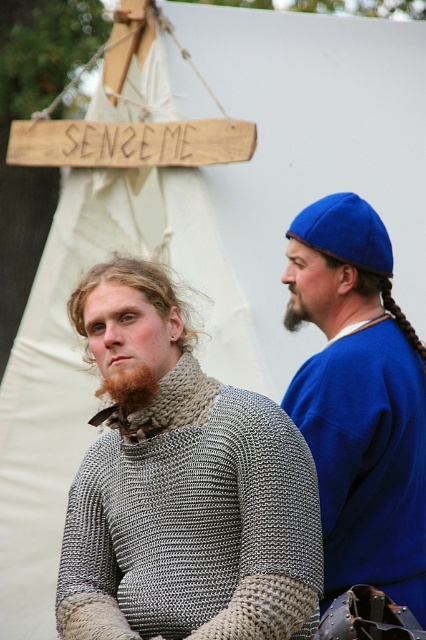
You are a costume designer preparing for a historical play. You need to ensure that the matte blue cap at upper right and the brownwoollybeard at right are proportionate to each other. Based on the image, which object should you adjust to make them more balanced in size?

The matte blue cap at upper right is larger in size than the brownwoollybeard at right, so you should reduce the size of the matte blue cap at upper right to achieve a more balanced appearance.